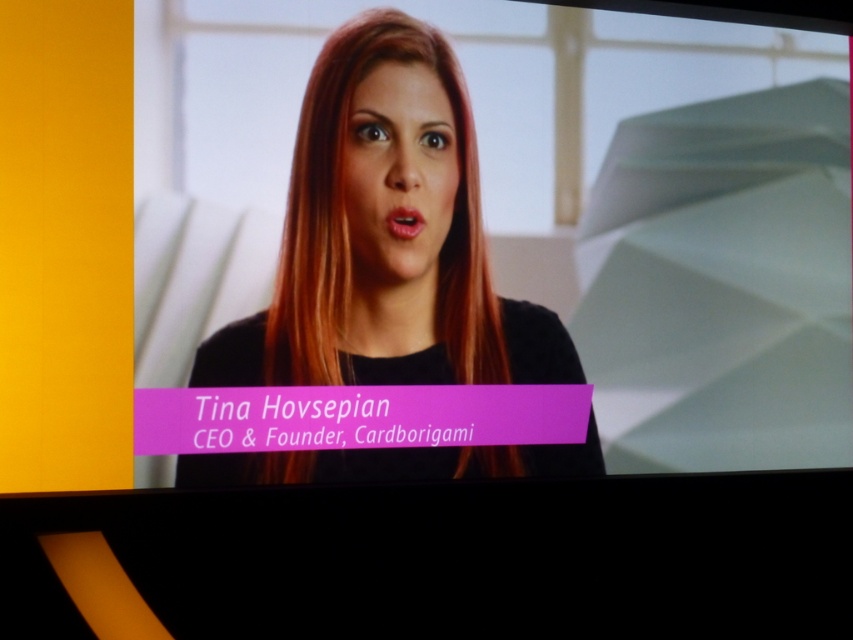
Based on the scene description, can you determine the spatial relationship between the black matte hair at center and the smooth skin face at center?

The black matte hair at center is located below the smooth skin face at center.

You are a graphic designer working on a project that requires precise placement of elements. You need to place a watermark on the image such that it doesn not cover any part of the woman s hair. The woman s hair is located at point (386,236). Where should you place the watermark to avoid overlapping with the woman s hair?

The black matte hair at center is located at point (386,236). To avoid overlapping, place the watermark away from this coordinate, such as in an empty area of the background.

You are a photographer adjusting the camera focus. The subject has a black matte hair at center and a smooth skin face at center. Which object should you focus on to ensure the larger one is sharp?

The black matte hair at center is bigger than the smooth skin face at center, so you should focus on the black matte hair at center to ensure the larger object is sharp.